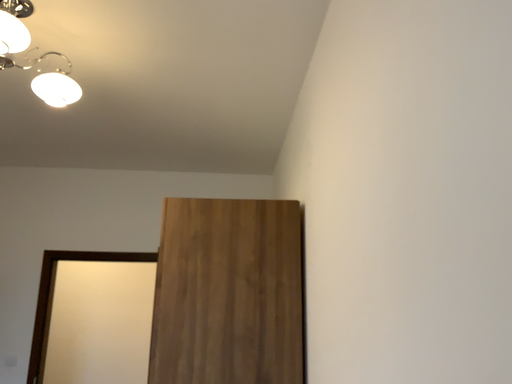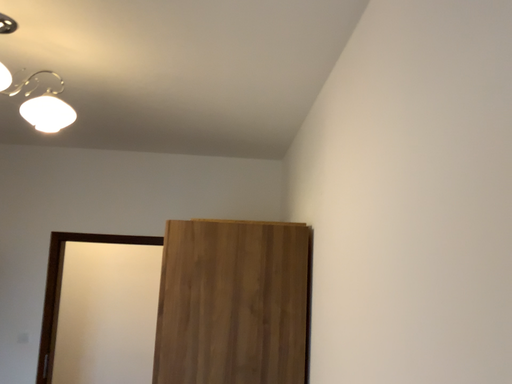
Question: How did the camera likely rotate when shooting the video?

Choices:
 (A) rotated upward
 (B) rotated downward

Answer: (B)